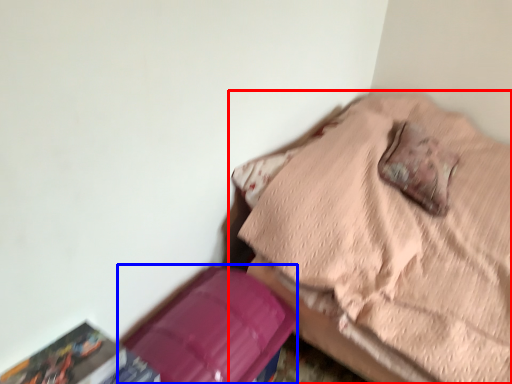
Question: Which object appears farthest to the camera in this image, furniture (highlighted by a red box) or cardboard box (highlighted by a blue box)?

Choices:
 (A) furniture
 (B) cardboard box

Answer: (B)